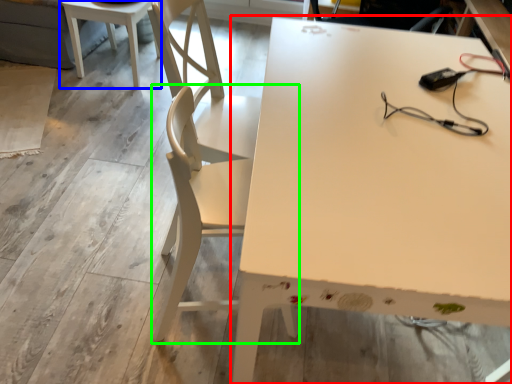
Question: Based on their relative distances, which object is farther from table (highlighted by a red box)? Choose from table (highlighted by a blue box) and chair (highlighted by a green box).

Choices:
 (A) table
 (B) chair

Answer: (A)